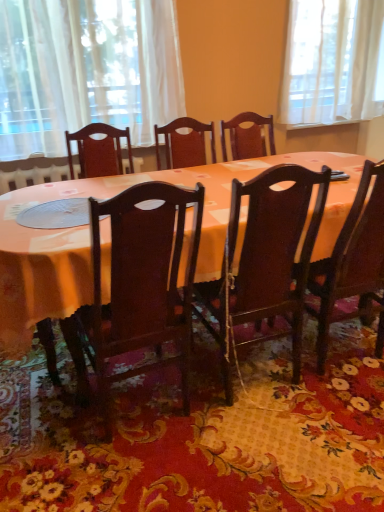
Question: Does matte wood table at center lie behind dark wood chair at center, the 3th chair when ordered from right to left?

Choices:
 (A) yes
 (B) no

Answer: (A)

Question: Considering the relative positions of matte wood table at center and dark wood chair at center, placed as the 1th chair when sorted from left to right, in the image provided, is matte wood table at center to the left of dark wood chair at center, placed as the 1th chair when sorted from left to right, from the viewer's perspective?

Choices:
 (A) yes
 (B) no

Answer: (B)

Question: From a real-world perspective, is matte wood table at center over dark wood chair at center, the 3th chair when ordered from right to left?

Choices:
 (A) no
 (B) yes

Answer: (A)

Question: Can you confirm if matte wood table at center is thinner than dark wood chair at center, the 3th chair when ordered from right to left?

Choices:
 (A) yes
 (B) no

Answer: (B)

Question: From the image's perspective, is matte wood table at center below dark wood chair at center, the 3th chair when ordered from right to left?

Choices:
 (A) yes
 (B) no

Answer: (B)

Question: Can we say matte wood table at center lies outside dark wood chair at center, placed as the 1th chair when sorted from left to right?

Choices:
 (A) no
 (B) yes

Answer: (B)

Question: Is the depth of white sheer curtain at upper left greater than that of matte wood table at center?

Choices:
 (A) no
 (B) yes

Answer: (B)

Question: Is white sheer curtain at upper left oriented away from matte wood table at center?

Choices:
 (A) yes
 (B) no

Answer: (B)

Question: Could you tell me if white sheer curtain at upper left is facing matte wood table at center?

Choices:
 (A) no
 (B) yes

Answer: (A)

Question: Can you confirm if white sheer curtain at upper left is smaller than matte wood table at center?

Choices:
 (A) no
 (B) yes

Answer: (B)

Question: Can we say white sheer curtain at upper left lies outside matte wood table at center?

Choices:
 (A) no
 (B) yes

Answer: (B)

Question: From the image's perspective, is white sheer curtain at upper left under matte wood table at center?

Choices:
 (A) yes
 (B) no

Answer: (B)

Question: Would you say matte wood table at center is a long distance from white sheer curtain at upper left?

Choices:
 (A) no
 (B) yes

Answer: (A)